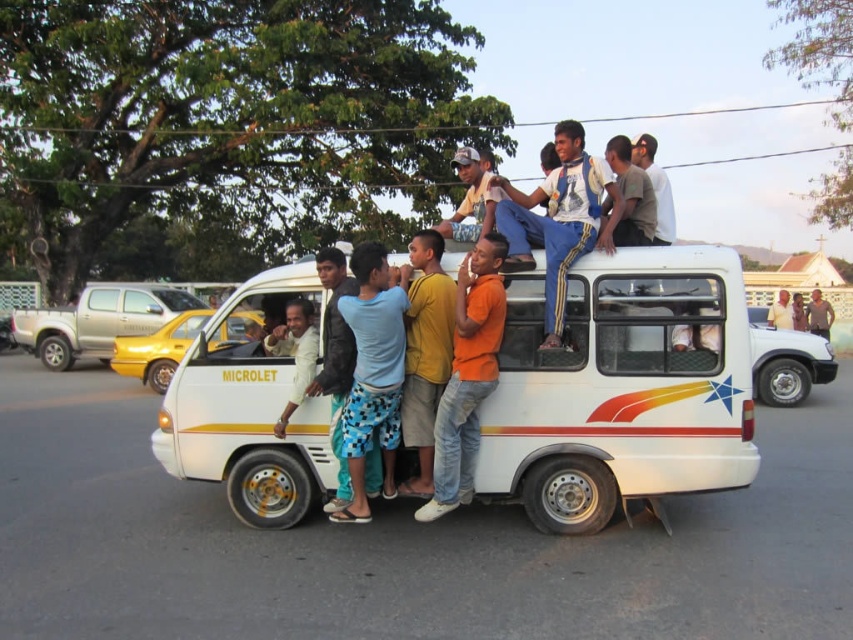
Question: Does white cotton shirt at upper center come behind light brown leather jacket at center?

Choices:
 (A) no
 (B) yes

Answer: (A)

Question: Can you confirm if blue printed shorts at center is wider than white glossy van at center?

Choices:
 (A) yes
 (B) no

Answer: (B)

Question: Can you confirm if orange cotton shirt at center is positioned below light brown wooden pole at upper right?

Choices:
 (A) no
 (B) yes

Answer: (B)

Question: Which point is closer to the camera taking this photo?

Choices:
 (A) (660, 288)
 (B) (41, 344)
 (C) (482, 227)
 (D) (787, 401)

Answer: (A)

Question: Which point is farther to the camera?

Choices:
 (A) white glossy van at center
 (B) white rubber tire at lower right
 (C) blue printed shorts at center
 (D) light brown leather jacket at center

Answer: (B)

Question: Which object is the closest to the gray cotton shirt at upper right?

Choices:
 (A) blue printed shorts at center
 (B) light brown leather jacket at center

Answer: (A)